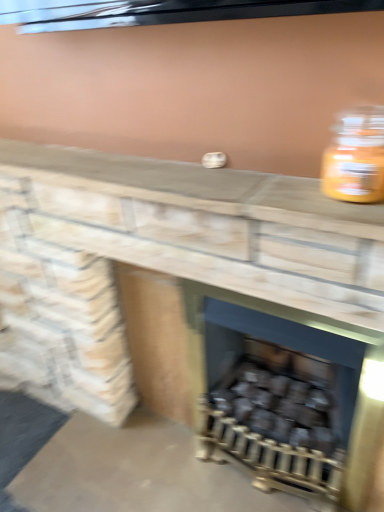
Locate an element on the screen. The height and width of the screenshot is (512, 384). free spot above smooth stone counter at center (from a real-world perspective) is located at coordinates (154, 174).